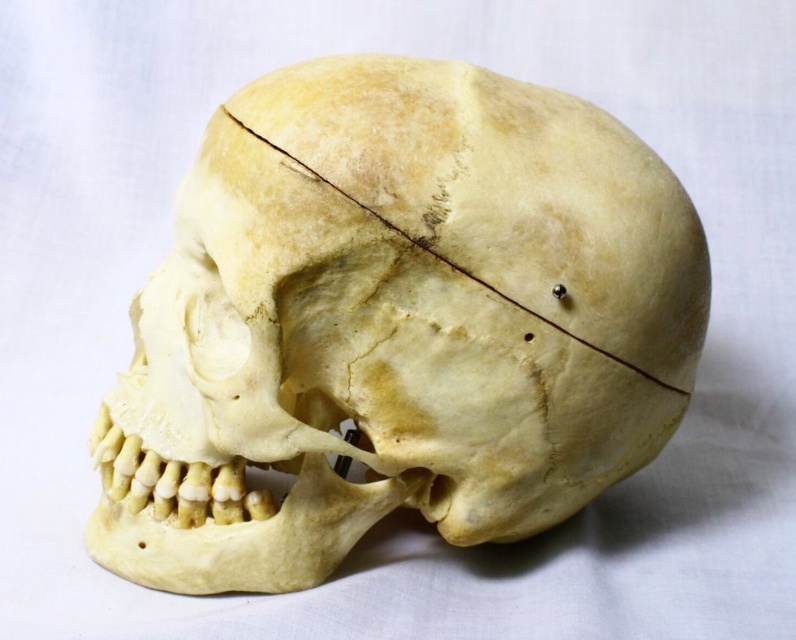
You are a museum curator arranging an exhibit. You have two items to place on a shelf. The items are the yellowish bone skull at center and the yellowish bone at center. According to the description, how far apart should you position them to match the original image?

The yellowish bone skull at center should be positioned 13.06 centimeters away from the yellowish bone at center to match the original image.

You are an anthropologist examining the image. You need to determine which object is taller between the yellowish bone skull at center and the yellowish bone at center. Based on the description provided, which one is taller?

The yellowish bone skull at center is taller than the yellowish bone at center according to the description.

You are an art student observing the yellowish bone skull at center and the yellowish bone at center in the image. Which object is located to the left of the other?

The yellowish bone skull at center is positioned on the left side of the yellowish bone at center.